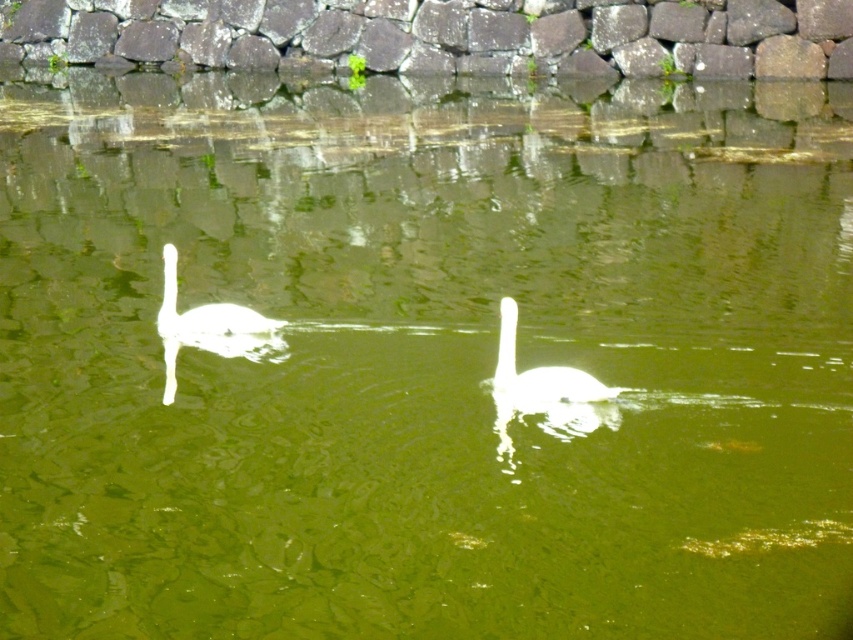
You are standing at the camera position and want to take a photo of the white glossy swan at center. If your camera has a maximum focus range of 6 meters, will you be able to focus on the swan?

The white glossy swan at center and camera are 6.62 meters apart. Since the distance is greater than the camera maximum focus range of 6 meters, you won not be able to focus on the swan.

You are a photographer trying to capture both swans in a single shot. Since the white glossy swan at center and the white glossy swan at left are positioned in a way that one might block the view of the other, which swan should you focus on to ensure the other is visible behind it?

The white glossy swan at center is in front of the white glossy swan at left, so focusing on the white glossy swan at center will allow the white glossy swan at left to be visible behind it.

You are standing on the stone wall in the background and see the point marked at coordinates (540, 371). What object is located at that point?

The point at coordinates (540, 371) indicates the white glossy swan at center.